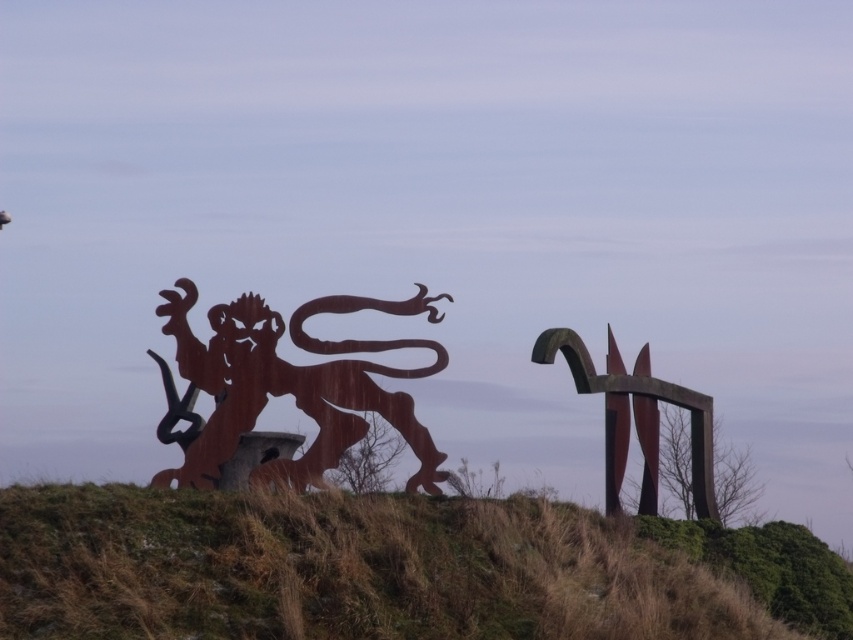
You are an artist planning to photograph the brown grassy hillside at lower center and the rusty metal lion at left. Which object appears taller in the image?

The rusty metal lion at left is taller than the brown grassy hillside at lower center.

You are a landscape photographer planning to capture the entire scene in one shot. You notice the brown grassy hillside at lower center and the rusty metal sculpture at right. Which object occupies a wider area in the image?

The brown grassy hillside at lower center is wider than the rusty metal sculpture at right, so it occupies a wider area in the image.